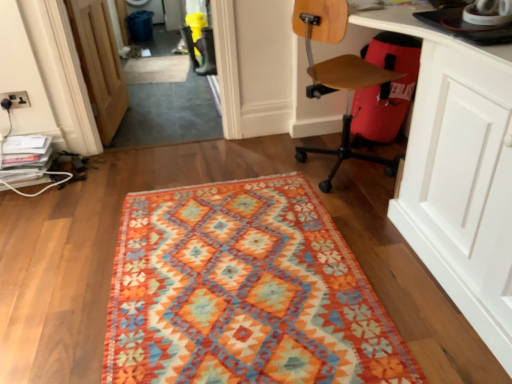
Where is `matte black electric outlet at upper left`? This screenshot has height=384, width=512. matte black electric outlet at upper left is located at coordinates (16, 99).

This screenshot has width=512, height=384. What do you see at coordinates (244, 292) in the screenshot?
I see `textured woolen rug at center` at bounding box center [244, 292].

Locate an element on the screen. This screenshot has height=384, width=512. textured woolen rug at center is located at coordinates (244, 292).

You are a GUI agent. You are given a task and a screenshot of the screen. Output one action in this format:
    pyautogui.click(x=<x>, y=<y>)
    Task: Click on the beige carpet at center
    The image size is (512, 384).
    Given the screenshot: What is the action you would take?
    pyautogui.click(x=156, y=69)

Measure the distance between point (425, 28) and camera.

Point (425, 28) and camera are 4.90 feet apart from each other.

Where is `matte black electric outlet at upper left`? matte black electric outlet at upper left is located at coordinates (16, 99).

From the image's perspective, does white glossy computer desk at lower right appear lower than wooden door at left?

Indeed, from the image's perspective, white glossy computer desk at lower right is shown beneath wooden door at left.

From the picture: What's the angular difference between white glossy computer desk at lower right and wooden door at left's facing directions?

The facing directions of white glossy computer desk at lower right and wooden door at left are 175 degrees apart.

Which point is more forward, (451,230) or (86,76)?

The point (451,230) is in front.

In terms of height, does white glossy computer desk at lower right look taller or shorter compared to wooden door at left?

white glossy computer desk at lower right is taller than wooden door at left.

Is textured woolen rug at center located outside wooden door at left?

That's correct, textured woolen rug at center is outside of wooden door at left.

Is textured woolen rug at center facing towards wooden door at left?

No, textured woolen rug at center does not turn towards wooden door at left.

Considering the relative positions of textured woolen rug at center and wooden door at left in the image provided, is textured woolen rug at center to the left of wooden door at left from the viewer's perspective?

No, textured woolen rug at center is not to the left of wooden door at left.

Can you confirm if textured woolen rug at center is wider than wooden door at left?

Correct, the width of textured woolen rug at center exceeds that of wooden door at left.

Do you think wooden door at left is within matte black electric outlet at upper left, or outside of it?

The correct answer is: outside.

Considering the sizes of objects wooden door at left and matte black electric outlet at upper left in the image provided, who is smaller, wooden door at left or matte black electric outlet at upper left?

With smaller size is matte black electric outlet at upper left.

From a real-world perspective, which object stands above the other?

wooden door at left.

Could you tell me if wooden door at left is turned towards matte black electric outlet at upper left?

No.

Is there a large distance between white glossy computer desk at lower right and matte black electric outlet at upper left?

Yes, white glossy computer desk at lower right and matte black electric outlet at upper left are located far from each other.

From a real-world perspective, who is located lower, white glossy computer desk at lower right or matte black electric outlet at upper left?

Result: matte black electric outlet at upper left is physically lower.

Considering the points (495, 315) and (2, 99), which point is in front, point (495, 315) or point (2, 99)?

The point (495, 315) is more forward.

Could you tell me if white glossy computer desk at lower right is turned towards matte black electric outlet at upper left?

Yes, white glossy computer desk at lower right is oriented towards matte black electric outlet at upper left.

Who is bigger, beige carpet at center or textured woolen rug at center?

textured woolen rug at center.

From the image's perspective, which one is positioned higher, beige carpet at center or textured woolen rug at center?

beige carpet at center appears higher in the image.

How far apart are beige carpet at center and textured woolen rug at center?

A distance of 2.49 meters exists between beige carpet at center and textured woolen rug at center.

Which is behind, point (152, 64) or point (159, 254)?

Point (152, 64)

Is beige carpet at center positioned far away from wooden door at left?

Absolutely, beige carpet at center is distant from wooden door at left.

What's the angular difference between beige carpet at center and wooden door at left's facing directions?

There is a 83.7-degree angle between the facing directions of beige carpet at center and wooden door at left.

Between beige carpet at center and wooden door at left, which one has smaller width?

wooden door at left.

Considering the relative sizes of beige carpet at center and wooden door at left in the image provided, is beige carpet at center smaller than wooden door at left?

Correct, beige carpet at center occupies less space than wooden door at left.

Visually, is matte black electric outlet at upper left positioned to the left or to the right of textured woolen rug at center?

In the image, matte black electric outlet at upper left appears on the left side of textured woolen rug at center.

From the image's perspective, who appears lower, matte black electric outlet at upper left or textured woolen rug at center?

textured woolen rug at center.

Image resolution: width=512 pixels, height=384 pixels. In order to click on electric outlet on the left of the textured woolen rug at center in this screenshot , I will do `click(16, 99)`.

Does matte black electric outlet at upper left have a lesser height compared to textured woolen rug at center?

In fact, matte black electric outlet at upper left may be taller than textured woolen rug at center.

Where is `computer desk in front of the wooden door at left`? computer desk in front of the wooden door at left is located at coordinates (459, 173).

You are a GUI agent. You are given a task and a screenshot of the screen. Output one action in this format:
    pyautogui.click(x=<x>, y=<y>)
    Task: Click on the mat that is on the right side of wooden door at left
    
    Given the screenshot: What is the action you would take?
    pyautogui.click(x=244, y=292)

Looking at the image, which one is located closer to textured woolen rug at center, wooden at right or white glossy computer desk at lower right?

Based on the image, white glossy computer desk at lower right appears to be nearer to textured woolen rug at center.

Which object lies nearer to the anchor point matte black electric outlet at upper left, white glossy computer desk at lower right or textured woolen rug at center?

Based on the image, textured woolen rug at center appears to be nearer to matte black electric outlet at upper left.

Based on the photo, based on their spatial positions, is wooden door at left or white glossy computer desk at lower right closer to textured woolen rug at center?

white glossy computer desk at lower right.

When comparing their distances from textured woolen rug at center, does white glossy computer desk at lower right or wooden door at left seem further?

wooden door at left is positioned further to the anchor textured woolen rug at center.

Estimate the real-world distances between objects in this image. Which object is further from textured woolen rug at center, white glossy computer desk at lower right or beige carpet at center?

Based on the image, beige carpet at center appears to be further to textured woolen rug at center.

From the image, which object appears to be farther from beige carpet at center, matte black electric outlet at upper left or textured woolen rug at center?

Among the two, textured woolen rug at center is located further to beige carpet at center.

From the image, which object appears to be farther from matte black electric outlet at upper left, textured woolen rug at center or white glossy computer desk at lower right?

white glossy computer desk at lower right lies further to matte black electric outlet at upper left than the other object.

Looking at the image, which one is located further to matte black electric outlet at upper left, wooden at right or white glossy computer desk at lower right?

white glossy computer desk at lower right is positioned further to the anchor matte black electric outlet at upper left.

This screenshot has height=384, width=512. Identify the location of electric outlet between textured woolen rug at center and beige carpet at center from front to back. (16, 99).

The image size is (512, 384). In order to click on door between white glossy computer desk at lower right and beige carpet at center in the front-back direction in this screenshot , I will do `click(99, 63)`.

This screenshot has width=512, height=384. In order to click on mat between wooden door at left and wooden at right in the horizontal direction in this screenshot , I will do `click(244, 292)`.

Locate an element on the screen. The height and width of the screenshot is (384, 512). chair between wooden door at left and white glossy computer desk at lower right is located at coordinates (336, 74).